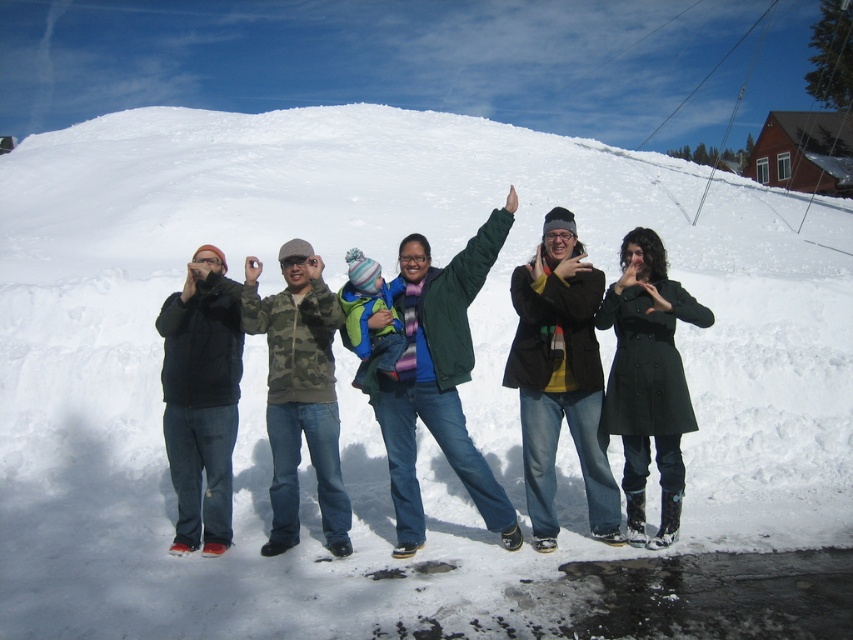
Who is positioned more to the left, black wool coat at center or black matte jacket at left?

black matte jacket at left

How distant is black wool coat at center from black matte jacket at left?

The distance of black wool coat at center from black matte jacket at left is 9.50 feet.

Find the location of `black wool coat at center`. black wool coat at center is located at coordinates (648, 378).

The width and height of the screenshot is (853, 640). I want to click on black wool coat at center, so click(648, 378).

Can you confirm if black matte jacket at center is positioned to the right of black matte jacket at left?

Yes, black matte jacket at center is to the right of black matte jacket at left.

Who is lower down, black matte jacket at center or black matte jacket at left?

Positioned lower is black matte jacket at left.

Measure the distance between point (583,401) and camera.

Point (583,401) and camera are 5.59 meters apart.

The width and height of the screenshot is (853, 640). Find the location of `black matte jacket at center`. black matte jacket at center is located at coordinates (x=560, y=378).

Does point (438, 410) come closer to viewer compared to point (688, 321)?

No, it is not.

The width and height of the screenshot is (853, 640). In order to click on green woolen jacket at center in this screenshot , I will do `click(439, 380)`.